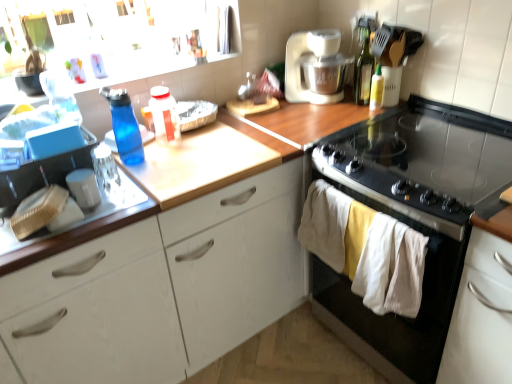
Question: Considering the relative sizes of white wood cabinet at center, which is the second cabinetry from right to left, and translucent plastic bottle at center, the 2th bottle positioned from the left, in the image provided, is white wood cabinet at center, which is the second cabinetry from right to left, wider than translucent plastic bottle at center, the 2th bottle positioned from the left,?

Choices:
 (A) no
 (B) yes

Answer: (B)

Question: From the image's perspective, does white wood cabinet at center, which is the second cabinetry from right to left, appear lower than translucent plastic bottle at center, the 2th bottle positioned from the left?

Choices:
 (A) no
 (B) yes

Answer: (B)

Question: Is white wood cabinet at center, which is the second cabinetry from right to left, to the left of translucent plastic bottle at center, the 2th bottle positioned from the left, from the viewer's perspective?

Choices:
 (A) yes
 (B) no

Answer: (B)

Question: Does white wood cabinet at center, which is the second cabinetry from right to left, lie behind translucent plastic bottle at center, the 2th bottle positioned from the left?

Choices:
 (A) no
 (B) yes

Answer: (A)

Question: Is translucent plastic bottle at center, the 2th bottle positioned from the left, a part of white wood cabinet at center, the 1th cabinetry in the left-to-right sequence?

Choices:
 (A) yes
 (B) no

Answer: (B)

Question: Is black glass gas stove at upper right in front of or behind yellow matte bottle at upper right, the 1th bottle in the right-to-left sequence, in the image?

Choices:
 (A) front
 (B) behind

Answer: (A)

Question: Considering the positions of black glass gas stove at upper right and yellow matte bottle at upper right, the 1th bottle in the right-to-left sequence, in the image, is black glass gas stove at upper right wider or thinner than yellow matte bottle at upper right, the 1th bottle in the right-to-left sequence,?

Choices:
 (A) wide
 (B) thin

Answer: (A)

Question: In the image, is black glass gas stove at upper right on the left side or the right side of yellow matte bottle at upper right, acting as the 4th bottle starting from the left?

Choices:
 (A) right
 (B) left

Answer: (A)

Question: Does point (429, 145) appear closer or farther from the camera than point (382, 87)?

Choices:
 (A) farther
 (B) closer

Answer: (B)

Question: From the image's perspective, is white wood cabinet at lower right, acting as the 2th cabinetry starting from the left, above or below black glass stove at right?

Choices:
 (A) above
 (B) below

Answer: (B)

Question: Considering the positions of white wood cabinet at lower right, acting as the 2th cabinetry starting from the left, and black glass stove at right in the image, is white wood cabinet at lower right, acting as the 2th cabinetry starting from the left, taller or shorter than black glass stove at right?

Choices:
 (A) short
 (B) tall

Answer: (B)

Question: Is white wood cabinet at lower right, the 1th cabinetry when ordered from right to left, bigger or smaller than black glass stove at right?

Choices:
 (A) small
 (B) big

Answer: (A)

Question: Is white wood cabinet at lower right, acting as the 2th cabinetry starting from the left, in front of or behind black glass stove at right in the image?

Choices:
 (A) behind
 (B) front

Answer: (B)

Question: From a real-world perspective, is black glass gas stove at upper right physically located above or below black glass stove at right?

Choices:
 (A) below
 (B) above

Answer: (B)

Question: In the image, is black glass gas stove at upper right on the left side or the right side of black glass stove at right?

Choices:
 (A) left
 (B) right

Answer: (A)